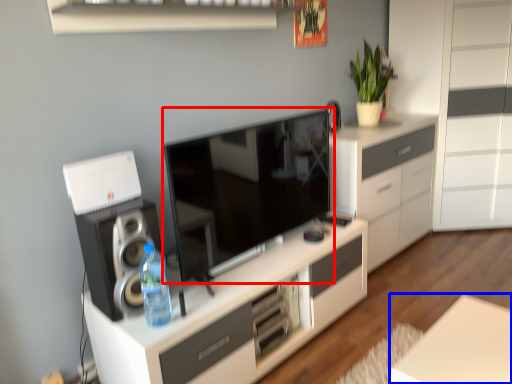
Question: Which object appears farthest to the camera in this image, television (highlighted by a red box) or table (highlighted by a blue box)?

Choices:
 (A) television
 (B) table

Answer: (A)